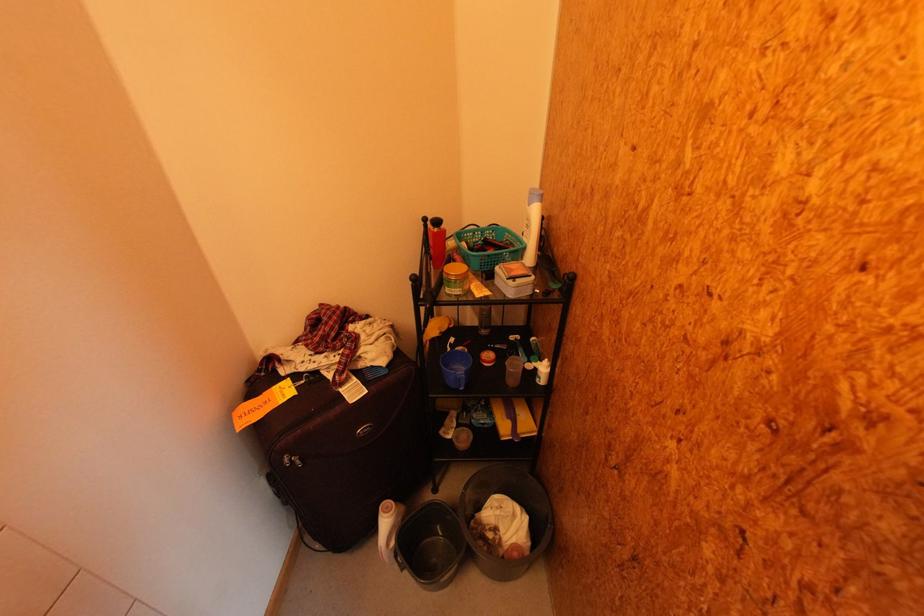
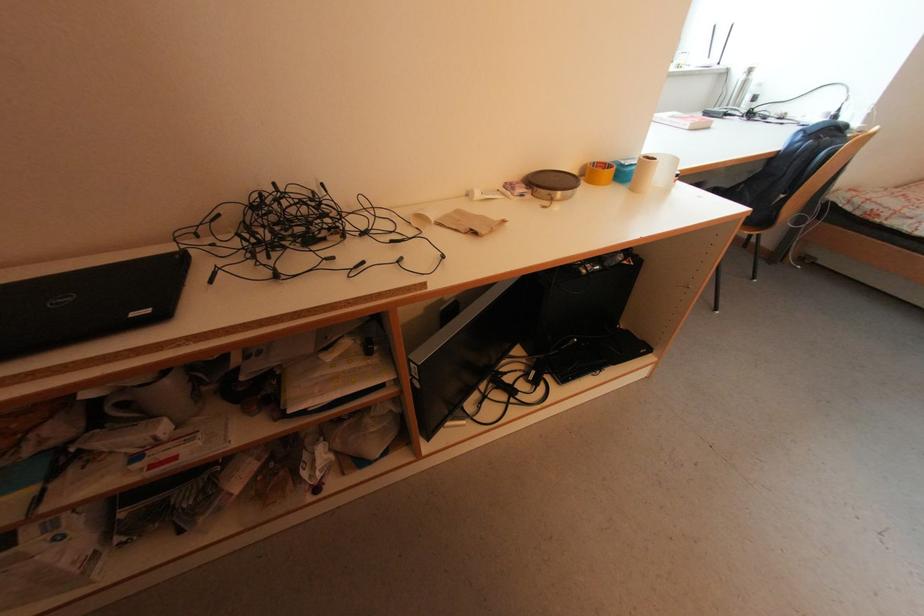
The images are taken continuously from a first-person perspective. In which direction is your viewpoint rotating?

The rotation direction of the camera is right-down.